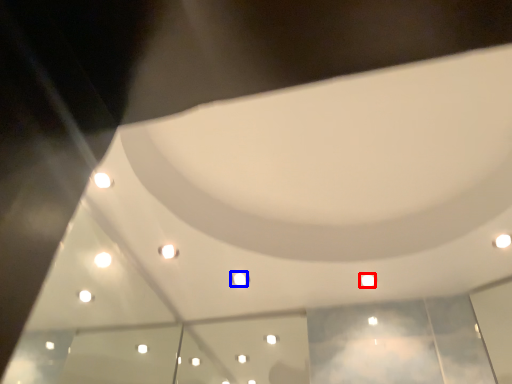
Question: Which of the following is the closest to the observer, light (highlighted by a red box) or light (highlighted by a blue box)?

Choices:
 (A) light
 (B) light

Answer: (A)